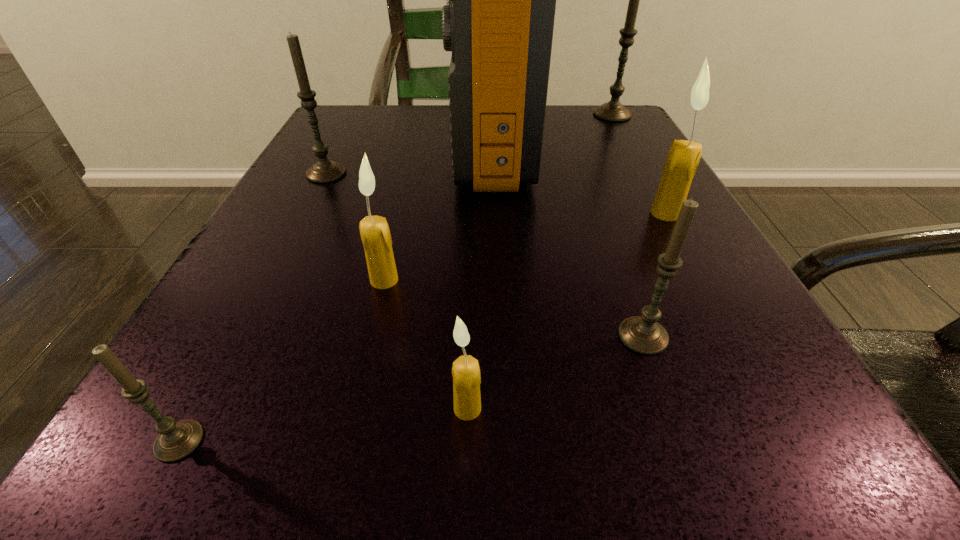
At what (x,y) coordinates should I click in order to perform the action: click on free space between the nearest object and the fifth farthest object. Please return your answer as a coordinate pair (x, y). This screenshot has width=960, height=540. Looking at the image, I should click on (281, 360).

In order to click on vacant space that's between the fifth farthest candle and the radio receiver in this screenshot , I will do `click(567, 242)`.

Locate an element on the screen. This screenshot has width=960, height=540. unoccupied area between the fourth candle from right to left and the nearest object is located at coordinates (324, 424).

The width and height of the screenshot is (960, 540). In order to click on vacant area that lies between the fifth candle from right to left and the nearest object in this screenshot , I will do `click(281, 360)`.

Find the location of a particular element. The height and width of the screenshot is (540, 960). free point between the nearest cream candle and the third smallest gray candle is located at coordinates (396, 291).

The image size is (960, 540). Find the location of `the fourth closest object to the tallest object`. the fourth closest object to the tallest object is located at coordinates (324, 171).

The width and height of the screenshot is (960, 540). What are the coordinates of `object that is the third nearest to the rightmost gray candle` in the screenshot? It's located at (324, 171).

Where is `candle object that ranks as the closest to the nearest cream candle`? The width and height of the screenshot is (960, 540). candle object that ranks as the closest to the nearest cream candle is located at coordinates (643, 334).

Identify which candle is the third nearest to the biggest cream candle. Please provide its 2D coordinates. Your answer should be formatted as a tuple, i.e. [(x, y)], where the tuple contains the x and y coordinates of a point satisfying the conditions above.

[(374, 230)]

Identify the location of gray candle that is the third closest one to the radio receiver. (643, 334).